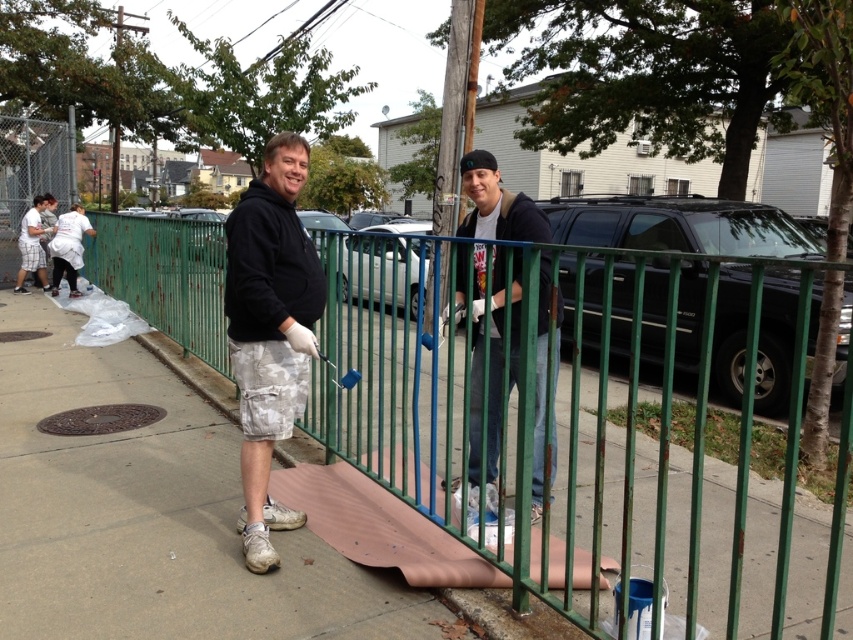
You are standing at the center of the image. Which object is located at the coordinates point (270,330)?

The point (270,330) indicates the location of the black matte hoodie at center.

You are a painter who needs to move a matte black hoodie at center out of the way to access the green painted metal fence at center. Which direction should you move the hoodie to clear the fence?

The green painted metal fence at center is to the left of the matte black hoodie at center, so you should move the matte black hoodie at center to the right to clear the fence.